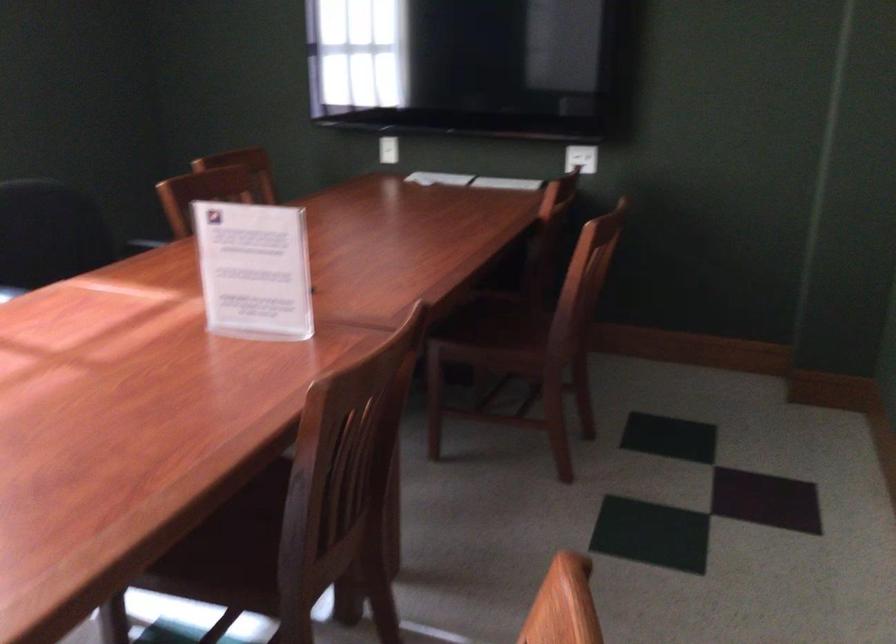
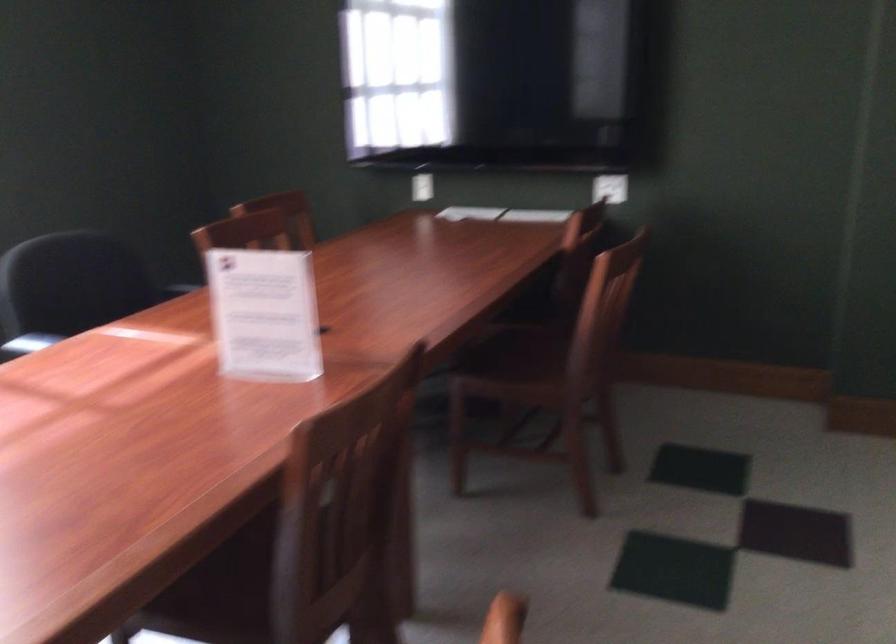
Question: The images are taken continuously from a first-person perspective. In which direction is your viewpoint rotating?

Choices:
 (A) Left
 (B) Right
 (C) Up
 (D) Down

Answer: (A)